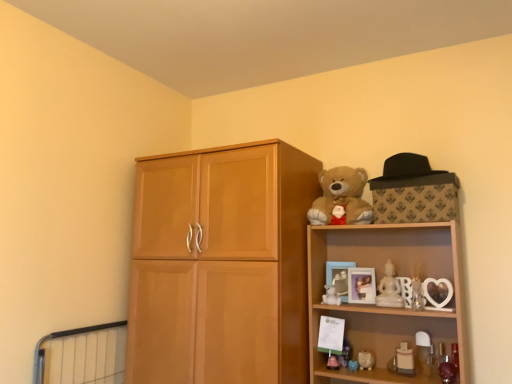
Question: Is white glossy bottle at lower right, acting as the fifth toy starting from the left, not within wooden picture frame at upper right, arranged as the 2th picture frame when viewed from the left?

Choices:
 (A) yes
 (B) no

Answer: (A)

Question: Does white glossy bottle at lower right, acting as the first toy starting from the right, have a greater width compared to wooden picture frame at upper right, which appears as the 1th picture frame when viewed from the right?

Choices:
 (A) no
 (B) yes

Answer: (A)

Question: From the image's perspective, is white glossy bottle at lower right, acting as the fifth toy starting from the left, on top of wooden picture frame at upper right, which appears as the 1th picture frame when viewed from the right?

Choices:
 (A) yes
 (B) no

Answer: (B)

Question: Is the position of white glossy bottle at lower right, acting as the first toy starting from the right, less distant than that of wooden picture frame at upper right, arranged as the 2th picture frame when viewed from the left?

Choices:
 (A) yes
 (B) no

Answer: (A)

Question: Can you confirm if white glossy bottle at lower right, acting as the fifth toy starting from the left, is bigger than wooden picture frame at upper right, which appears as the 1th picture frame when viewed from the right?

Choices:
 (A) yes
 (B) no

Answer: (B)

Question: Is white glossy bottle at lower right, acting as the first toy starting from the right, positioned with its back to wooden picture frame at upper right, arranged as the 2th picture frame when viewed from the left?

Choices:
 (A) no
 (B) yes

Answer: (A)

Question: Is white matte teddy bear at upper right, which is the 5th toy in right-to-left order, shorter than light brown wood cupboard at center?

Choices:
 (A) no
 (B) yes

Answer: (B)

Question: Is the depth of white matte teddy bear at upper right, which is the 5th toy in right-to-left order, greater than that of light brown wood cupboard at center?

Choices:
 (A) yes
 (B) no

Answer: (A)

Question: Considering the relative sizes of white matte teddy bear at upper right, which is the 5th toy in right-to-left order, and light brown wood cupboard at center in the image provided, is white matte teddy bear at upper right, which is the 5th toy in right-to-left order, thinner than light brown wood cupboard at center?

Choices:
 (A) yes
 (B) no

Answer: (A)

Question: Is white matte teddy bear at upper right, which is the 5th toy in right-to-left order, not inside light brown wood cupboard at center?

Choices:
 (A) yes
 (B) no

Answer: (A)

Question: Does white matte teddy bear at upper right, which is the 5th toy in right-to-left order, have a larger size compared to light brown wood cupboard at center?

Choices:
 (A) no
 (B) yes

Answer: (A)

Question: Considering the relative sizes of white matte teddy bear at upper right, which is the 5th toy in right-to-left order, and light brown wood cupboard at center in the image provided, is white matte teddy bear at upper right, which is the 5th toy in right-to-left order, taller than light brown wood cupboard at center?

Choices:
 (A) no
 (B) yes

Answer: (A)

Question: Does white glossy piggy bank at lower right, the second toy viewed from the left, have a lesser width compared to white glossy candle at lower right, which is the 4th toy from left to right?

Choices:
 (A) yes
 (B) no

Answer: (B)